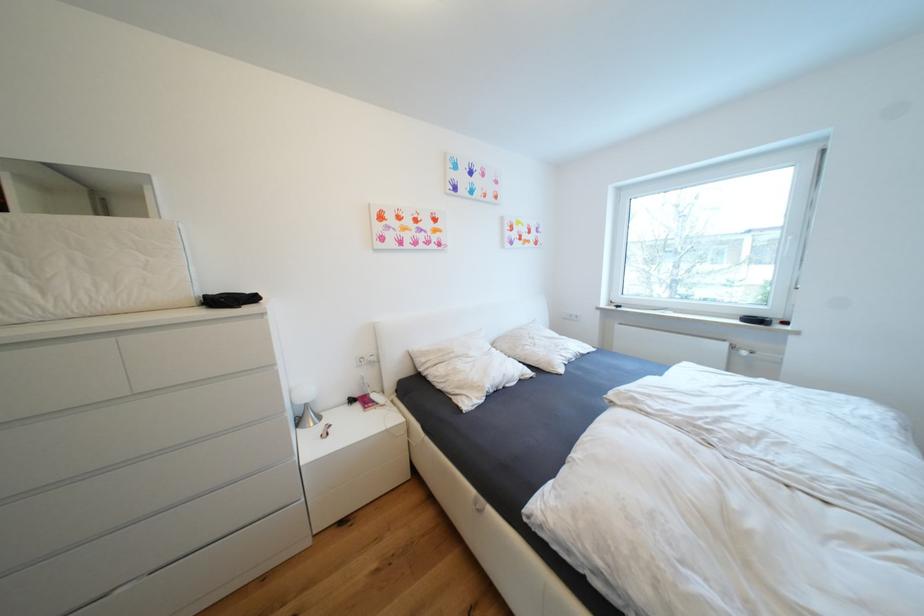
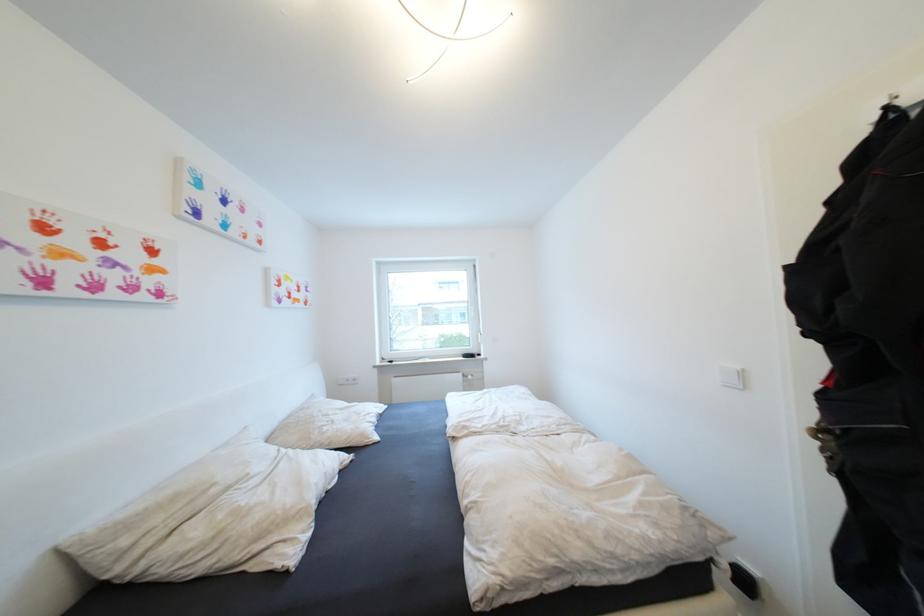
The point at (541, 346) is marked in the first image. Where is the corresponding point in the second image?

(339, 423)